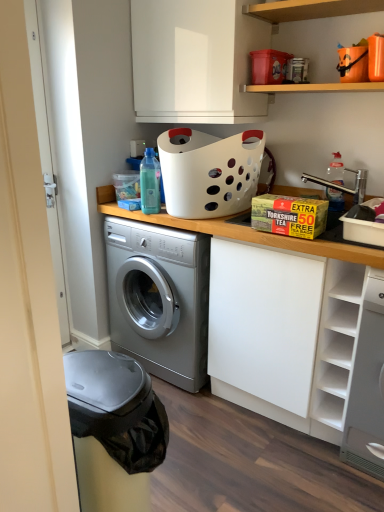
What do you see at coordinates (209, 172) in the screenshot?
I see `white plastic basket at upper center` at bounding box center [209, 172].

What do you see at coordinates (335, 349) in the screenshot? The height and width of the screenshot is (512, 384). I see `white matte shelf at right, positioned as the 2th shelf in top-to-bottom order` at bounding box center [335, 349].

The image size is (384, 512). Find the location of `white glossy cabinet at upper center`. white glossy cabinet at upper center is located at coordinates (194, 61).

This screenshot has width=384, height=512. What do you see at coordinates (150, 183) in the screenshot?
I see `transparent plastic bottle at center, the second bottle viewed from the right` at bounding box center [150, 183].

The height and width of the screenshot is (512, 384). What do you see at coordinates (336, 170) in the screenshot?
I see `clear plastic bottle at upper right, which is the first bottle in right-to-left order` at bounding box center [336, 170].

What do you see at coordinates (246, 233) in the screenshot?
I see `white matte cabinet at center` at bounding box center [246, 233].

You are a GUI agent. You are given a task and a screenshot of the screen. Output one action in this format:
    pyautogui.click(x=<x>, y=<y>)
    Task: Click on the white plastic basket at upper center
    The width and height of the screenshot is (384, 512).
    Given the screenshot: What is the action you would take?
    pyautogui.click(x=209, y=172)

Is wooden shelf at upper center, placed as the second shelf when sorted from bottom to top, closer to camera compared to clear plastic bottle at upper right, placed as the 2th bottle when sorted from left to right?

Yes, the depth of wooden shelf at upper center, placed as the second shelf when sorted from bottom to top, is less than that of clear plastic bottle at upper right, placed as the 2th bottle when sorted from left to right.

From a real-world perspective, is wooden shelf at upper center, which is the 1th shelf in top-to-bottom order, physically below clear plastic bottle at upper right, placed as the 2th bottle when sorted from left to right?

No.

Considering the sizes of wooden shelf at upper center, which is the 1th shelf in top-to-bottom order, and clear plastic bottle at upper right, which is the first bottle in right-to-left order, in the image, is wooden shelf at upper center, which is the 1th shelf in top-to-bottom order, taller or shorter than clear plastic bottle at upper right, which is the first bottle in right-to-left order,?

Considering their sizes, wooden shelf at upper center, which is the 1th shelf in top-to-bottom order, has less height than clear plastic bottle at upper right, which is the first bottle in right-to-left order.

Is wooden shelf at upper center, which is the 1th shelf in top-to-bottom order, facing away from clear plastic bottle at upper right, placed as the 2th bottle when sorted from left to right?

No, wooden shelf at upper center, which is the 1th shelf in top-to-bottom order, is not facing the opposite direction of clear plastic bottle at upper right, placed as the 2th bottle when sorted from left to right.

From a real-world perspective, which is physically above, white matte shelf at right, acting as the 1th shelf starting from the bottom, or clear plastic bottle at upper right, placed as the 2th bottle when sorted from left to right?

clear plastic bottle at upper right, placed as the 2th bottle when sorted from left to right, from a real-world perspective.

From the image's perspective, which one is positioned higher, white matte shelf at right, positioned as the 2th shelf in top-to-bottom order, or clear plastic bottle at upper right, which is the first bottle in right-to-left order?

clear plastic bottle at upper right, which is the first bottle in right-to-left order, is shown above in the image.

Considering the positions of objects white matte shelf at right, acting as the 1th shelf starting from the bottom, and clear plastic bottle at upper right, placed as the 2th bottle when sorted from left to right, in the image provided, who is in front, white matte shelf at right, acting as the 1th shelf starting from the bottom, or clear plastic bottle at upper right, placed as the 2th bottle when sorted from left to right,?

Positioned in front is white matte shelf at right, acting as the 1th shelf starting from the bottom.

Could you measure the distance between white matte shelf at right, positioned as the 2th shelf in top-to-bottom order, and clear plastic bottle at upper right, which is the first bottle in right-to-left order?

The distance of white matte shelf at right, positioned as the 2th shelf in top-to-bottom order, from clear plastic bottle at upper right, which is the first bottle in right-to-left order, is 20.85 inches.

Considering the sizes of wooden shelf at upper center, which is the 1th shelf in top-to-bottom order, and white glossy cabinet at upper center in the image, is wooden shelf at upper center, which is the 1th shelf in top-to-bottom order, taller or shorter than white glossy cabinet at upper center?

Clearly, wooden shelf at upper center, which is the 1th shelf in top-to-bottom order, is shorter compared to white glossy cabinet at upper center.

How many degrees apart are the facing directions of wooden shelf at upper center, placed as the second shelf when sorted from bottom to top, and white glossy cabinet at upper center?

0.555 degrees separate the facing orientations of wooden shelf at upper center, placed as the second shelf when sorted from bottom to top, and white glossy cabinet at upper center.

The height and width of the screenshot is (512, 384). I want to click on cabinetry located behind the wooden shelf at upper center, which is the 1th shelf in top-to-bottom order, so click(x=194, y=61).

Considering the sizes of objects wooden shelf at upper center, placed as the second shelf when sorted from bottom to top, and white glossy cabinet at upper center in the image provided, who is thinner, wooden shelf at upper center, placed as the second shelf when sorted from bottom to top, or white glossy cabinet at upper center?

Thinner between the two is wooden shelf at upper center, placed as the second shelf when sorted from bottom to top.

Which object is wider, transparent plastic bottle at center, the first bottle viewed from the left, or white plastic basket at upper center?

white plastic basket at upper center is wider.

The height and width of the screenshot is (512, 384). There is a transparent plastic bottle at center, the second bottle viewed from the right. In order to click on basket above it (from a real-world perspective) in this screenshot , I will do coord(209,172).

In the scene shown: Does transparent plastic bottle at center, the second bottle viewed from the right, have a larger size compared to white plastic basket at upper center?

No, transparent plastic bottle at center, the second bottle viewed from the right, is not bigger than white plastic basket at upper center.

From the image's perspective, does transparent plastic bottle at center, the first bottle viewed from the left, appear lower than white plastic basket at upper center?

Yes, from the image's perspective, transparent plastic bottle at center, the first bottle viewed from the left, is beneath white plastic basket at upper center.

Is white smooth door at left located outside white matte cabinet at center?

Absolutely, white smooth door at left is external to white matte cabinet at center.

From the image's perspective, between white smooth door at left and white matte cabinet at center, who is located below?

From the image's view, white matte cabinet at center is below.

Where is `counter top located underneath the white smooth door at left (from a real-world perspective)`? The image size is (384, 512). counter top located underneath the white smooth door at left (from a real-world perspective) is located at coordinates (246, 233).

Considering the relative sizes of white smooth door at left and white matte cabinet at center in the image provided, is white smooth door at left bigger than white matte cabinet at center?

No, white smooth door at left is not bigger than white matte cabinet at center.

From a real-world perspective, is wooden shelf at upper center, which is the 1th shelf in top-to-bottom order, positioned under white matte cabinet at center based on gravity?

Actually, wooden shelf at upper center, which is the 1th shelf in top-to-bottom order, is physically above white matte cabinet at center in the real world.

Considering the relative sizes of wooden shelf at upper center, placed as the second shelf when sorted from bottom to top, and white matte cabinet at center in the image provided, is wooden shelf at upper center, placed as the second shelf when sorted from bottom to top, wider than white matte cabinet at center?

No.

Is wooden shelf at upper center, which is the 1th shelf in top-to-bottom order, bigger or smaller than white matte cabinet at center?

wooden shelf at upper center, which is the 1th shelf in top-to-bottom order, is smaller than white matte cabinet at center.

Is clear plastic bottle at upper right, placed as the 2th bottle when sorted from left to right, turned away from white matte shelf at right, acting as the 1th shelf starting from the bottom?

That's not correct — clear plastic bottle at upper right, placed as the 2th bottle when sorted from left to right, is not looking away from white matte shelf at right, acting as the 1th shelf starting from the bottom.

How different are the orientations of clear plastic bottle at upper right, which is the first bottle in right-to-left order, and white matte shelf at right, acting as the 1th shelf starting from the bottom, in degrees?

The facing directions of clear plastic bottle at upper right, which is the first bottle in right-to-left order, and white matte shelf at right, acting as the 1th shelf starting from the bottom, are 1.23 degrees apart.

The width and height of the screenshot is (384, 512). What are the coordinates of `shelf below the clear plastic bottle at upper right, which is the first bottle in right-to-left order (from a real-world perspective)` in the screenshot? It's located at (335, 349).

Between point (334, 153) and point (347, 266), which one is positioned behind?

Point (334, 153)

At what (x,y) coordinates should I click in order to perform the action: click on bottle on the right side of wooden shelf at upper center, which is the 1th shelf in top-to-bottom order. Please return your answer as a coordinate pair (x, y). Looking at the image, I should click on (336, 170).

I want to click on the 1st bottle to the left of the white matte shelf at right, positioned as the 2th shelf in top-to-bottom order, counting from the anchor's position, so click(336, 170).

Based on their spatial positions, is white matte shelf at right, positioned as the 2th shelf in top-to-bottom order, or clear plastic bottle at upper right, which is the first bottle in right-to-left order, closer to white smooth door at left?

white matte shelf at right, positioned as the 2th shelf in top-to-bottom order, lies closer to white smooth door at left than the other object.

Considering their positions, is white plastic basket at upper center positioned closer to wooden shelf at upper center, placed as the second shelf when sorted from bottom to top, than white matte shelf at right, positioned as the 2th shelf in top-to-bottom order?

white plastic basket at upper center lies closer to wooden shelf at upper center, placed as the second shelf when sorted from bottom to top, than the other object.

Considering their positions, is transparent plastic bottle at center, the first bottle viewed from the left, positioned further to white plastic basket at upper center than clear plastic bottle at upper right, which is the first bottle in right-to-left order?

Among the two, clear plastic bottle at upper right, which is the first bottle in right-to-left order, is located further to white plastic basket at upper center.

Considering their positions, is clear plastic bottle at upper right, placed as the 2th bottle when sorted from left to right, positioned further to transparent plastic bottle at center, the second bottle viewed from the right, than wooden shelf at upper center, placed as the second shelf when sorted from bottom to top?

Result: Among the two, wooden shelf at upper center, placed as the second shelf when sorted from bottom to top, is located further to transparent plastic bottle at center, the second bottle viewed from the right.

From the image, which object appears to be nearer to wooden shelf at upper center, which is the 1th shelf in top-to-bottom order, white glossy cabinet at upper center or transparent plastic bottle at center, the second bottle viewed from the right?

white glossy cabinet at upper center lies closer to wooden shelf at upper center, which is the 1th shelf in top-to-bottom order, than the other object.

Based on their spatial positions, is transparent plastic bottle at center, the second bottle viewed from the right, or clear plastic bottle at upper right, placed as the 2th bottle when sorted from left to right, closer to wooden shelf at upper center, which is the 1th shelf in top-to-bottom order?

Among the two, clear plastic bottle at upper right, placed as the 2th bottle when sorted from left to right, is located nearer to wooden shelf at upper center, which is the 1th shelf in top-to-bottom order.

From the image, which object appears to be nearer to white glossy cabinet at upper center, white matte shelf at right, acting as the 1th shelf starting from the bottom, or white smooth door at left?

white matte shelf at right, acting as the 1th shelf starting from the bottom, lies closer to white glossy cabinet at upper center than the other object.

When comparing their distances from clear plastic bottle at upper right, which is the first bottle in right-to-left order, does white plastic basket at upper center or white matte cabinet at center seem further?

Among the two, white plastic basket at upper center is located further to clear plastic bottle at upper right, which is the first bottle in right-to-left order.

This screenshot has width=384, height=512. In order to click on counter top between white glossy cabinet at upper center and white matte shelf at right, acting as the 1th shelf starting from the bottom, vertically in this screenshot , I will do `click(246, 233)`.

Locate an element on the screen. Image resolution: width=384 pixels, height=512 pixels. counter top located between transparent plastic bottle at center, the first bottle viewed from the left, and clear plastic bottle at upper right, which is the first bottle in right-to-left order, in the left-right direction is located at coordinates (246, 233).

The image size is (384, 512). In order to click on cabinetry between wooden shelf at upper center, placed as the second shelf when sorted from bottom to top, and clear plastic bottle at upper right, which is the first bottle in right-to-left order, from top to bottom in this screenshot , I will do `click(194, 61)`.

The image size is (384, 512). What are the coordinates of `basket that lies between wooden shelf at upper center, placed as the second shelf when sorted from bottom to top, and white matte shelf at right, acting as the 1th shelf starting from the bottom, from top to bottom` in the screenshot? It's located at (209, 172).